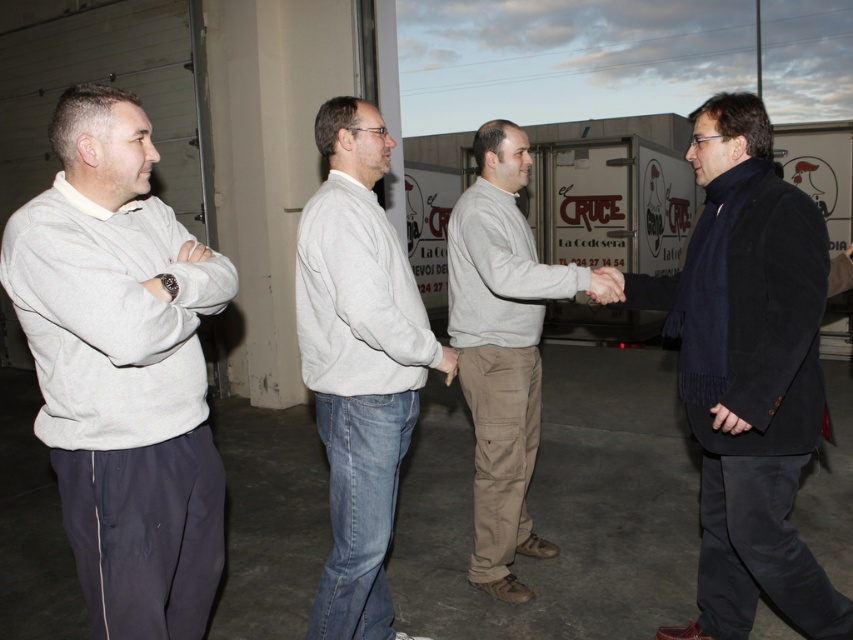
Is dark blue woolen coat at right taller than khaki cotton pants at center?

Incorrect, dark blue woolen coat at right's height is not larger of khaki cotton pants at center's.

In the scene shown: Does dark blue woolen coat at right have a greater width compared to khaki cotton pants at center?

Correct, the width of dark blue woolen coat at right exceeds that of khaki cotton pants at center.

What do you see at coordinates (747, 372) in the screenshot? I see `dark blue woolen coat at right` at bounding box center [747, 372].

Locate an element on the screen. Image resolution: width=853 pixels, height=640 pixels. dark blue woolen coat at right is located at coordinates (747, 372).

Can you confirm if dark blue woolen coat at right is positioned above gray sweatshirt at center?

Indeed, dark blue woolen coat at right is positioned over gray sweatshirt at center.

Identify the location of dark blue woolen coat at right. (747, 372).

Does point (602, 272) come in front of point (369, 316)?

No, it is behind (369, 316).

The image size is (853, 640). What are the coordinates of `dark blue woolen coat at right` in the screenshot? It's located at (747, 372).

Does light gray sweatshirt at left appear on the left side of dark blue woolen coat at right?

Yes, light gray sweatshirt at left is to the left of dark blue woolen coat at right.

Can you confirm if light gray sweatshirt at left is shorter than dark blue woolen coat at right?

Yes, light gray sweatshirt at left is shorter than dark blue woolen coat at right.

Where is `light gray sweatshirt at left`? light gray sweatshirt at left is located at coordinates (122, 369).

Find the location of a particular element. This screenshot has width=853, height=640. light gray sweatshirt at left is located at coordinates (122, 369).